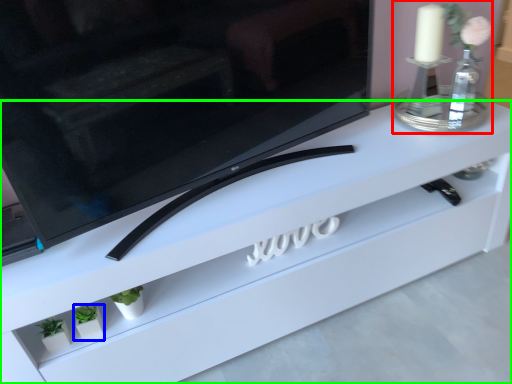
Question: Which object is the closest to the candle holder (highlighted by a red box)? Choose among these: plant (highlighted by a blue box) or furniture (highlighted by a green box).

Choices:
 (A) plant
 (B) furniture

Answer: (B)